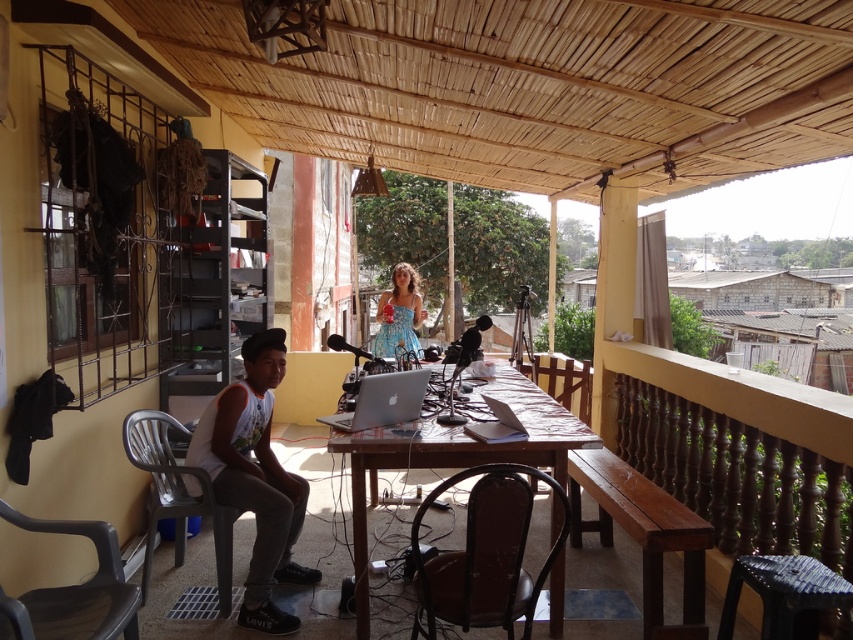
This screenshot has height=640, width=853. Describe the element at coordinates (254, 477) in the screenshot. I see `white plastic chair at lower left` at that location.

Does white plastic chair at lower left come in front of blue printed dress at center?

Yes, it is in front of blue printed dress at center.

Does point (242, 500) come farther from viewer compared to point (396, 308)?

No, it is in front of (396, 308).

Find the location of a particular element. This screenshot has width=853, height=640. white plastic chair at lower left is located at coordinates (254, 477).

Is point (332, 436) positioned in front of point (410, 397)?

Yes, it is in front of point (410, 397).

Who is more distant from viewer, (485, 458) or (384, 385)?

The point (384, 385) is behind.

Between point (520, 452) and point (408, 413), which one is positioned in front?

Point (520, 452) is in front.

At what (x,y) coordinates should I click in order to perform the action: click on wooden table at center. Please return your answer as a coordinate pair (x, y). This screenshot has width=853, height=640. Looking at the image, I should click on (454, 456).

Is point (403, 385) closer to viewer compared to point (393, 349)?

Yes, point (403, 385) is in front of point (393, 349).

Is silver metallic laptop at center further to the viewer compared to blue printed dress at center?

No, it is not.

Who is more forward, (410, 390) or (397, 314)?

Positioned in front is point (410, 390).

In order to click on silver metallic laptop at center in this screenshot , I will do `click(383, 401)`.